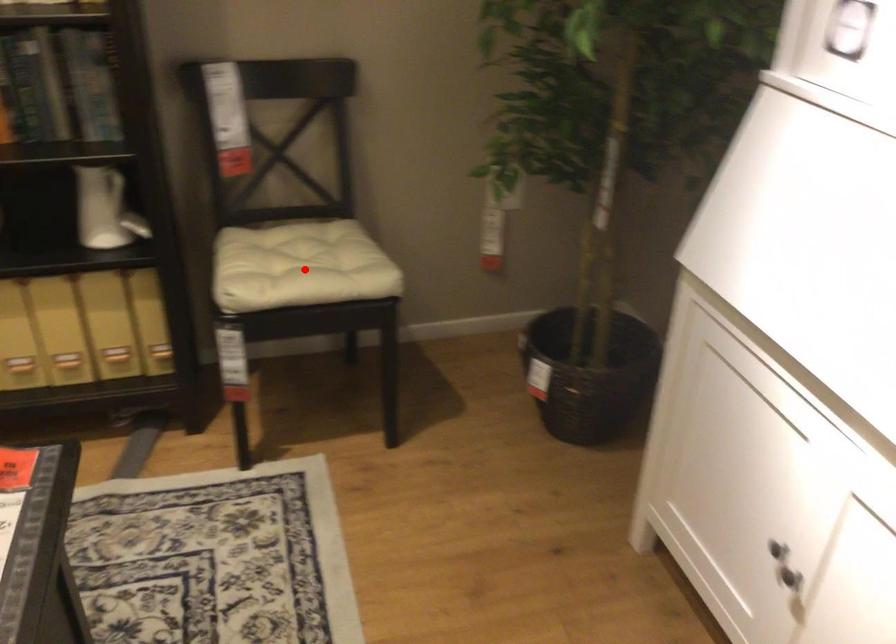
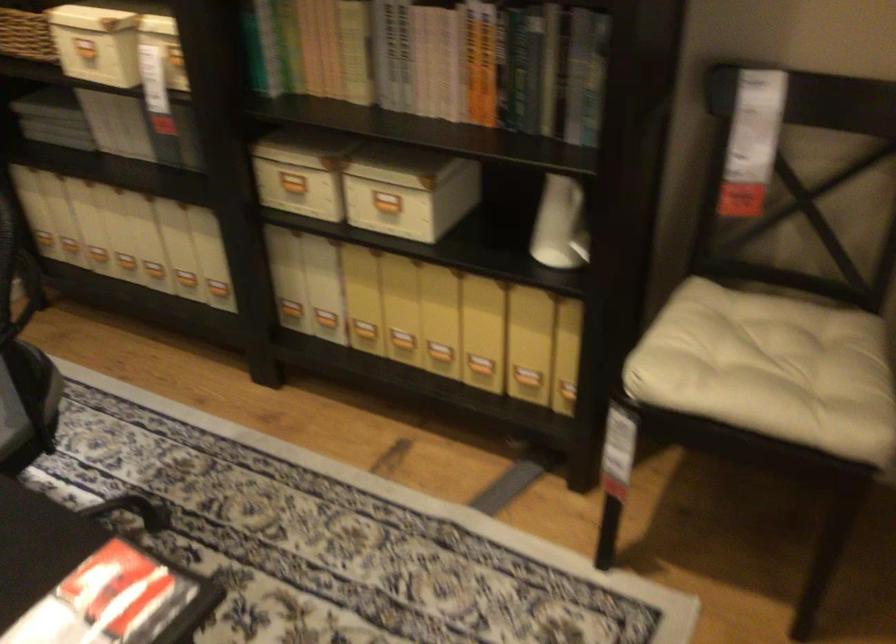
Question: A red point is marked in image1. In image2, is the corresponding 3D point closer to the camera or farther? Reply with the corresponding letter.

Choices:
 (A) The corresponding 3D point is closer.
 (B) The corresponding 3D point is farther.

Answer: (A)